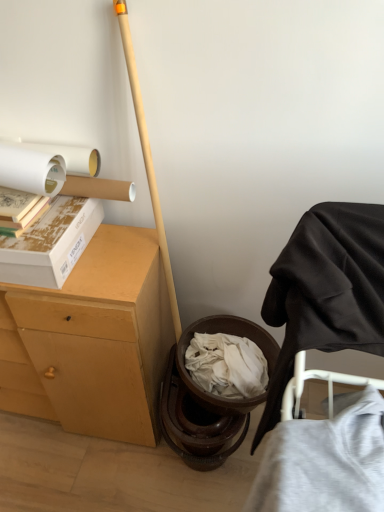
The width and height of the screenshot is (384, 512). Identify the location of empty space that is in between matte cardboard book at upper left and white matte toilet paper at upper left. (61, 214).